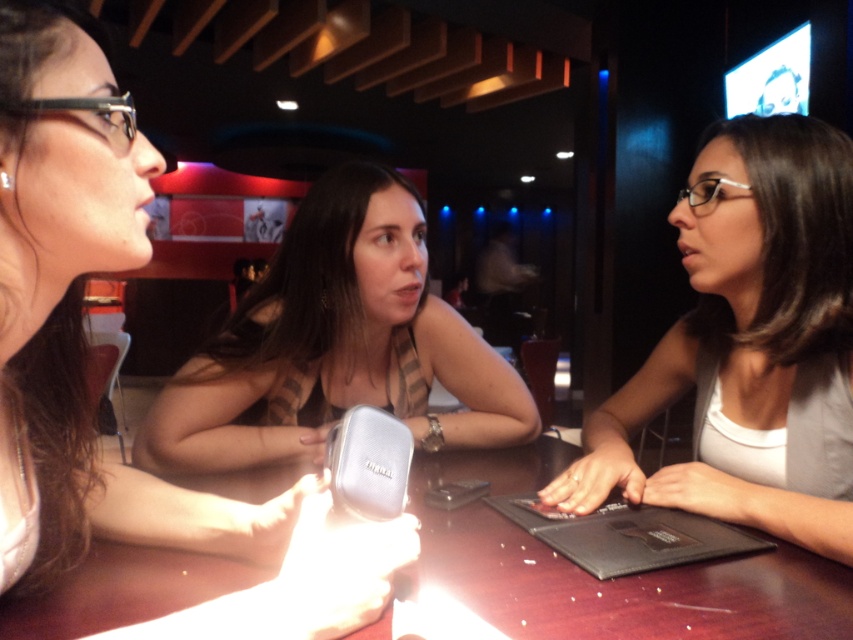
Question: From the image, what is the correct spatial relationship of black matte laptop at center in relation to silver metallic phone at center?

Choices:
 (A) above
 (B) below

Answer: (B)

Question: Which object is positioned closest to the black matte laptop at center?

Choices:
 (A) brown textured tank top at center
 (B) silver metallic phone at center
 (C) matte black laptop at center

Answer: (B)

Question: Can you confirm if wooden table at center is positioned above black matte laptop at center?

Choices:
 (A) yes
 (B) no

Answer: (A)

Question: Which point is closer to the camera taking this photo?

Choices:
 (A) (53, 186)
 (B) (657, 525)
 (C) (370, 486)
 (D) (735, 291)

Answer: (A)

Question: Can you confirm if wooden table at center is wider than black matte laptop at center?

Choices:
 (A) no
 (B) yes

Answer: (B)

Question: Among these points, which one is nearest to the camera?

Choices:
 (A) (511, 618)
 (B) (352, 493)
 (C) (306, 320)

Answer: (B)